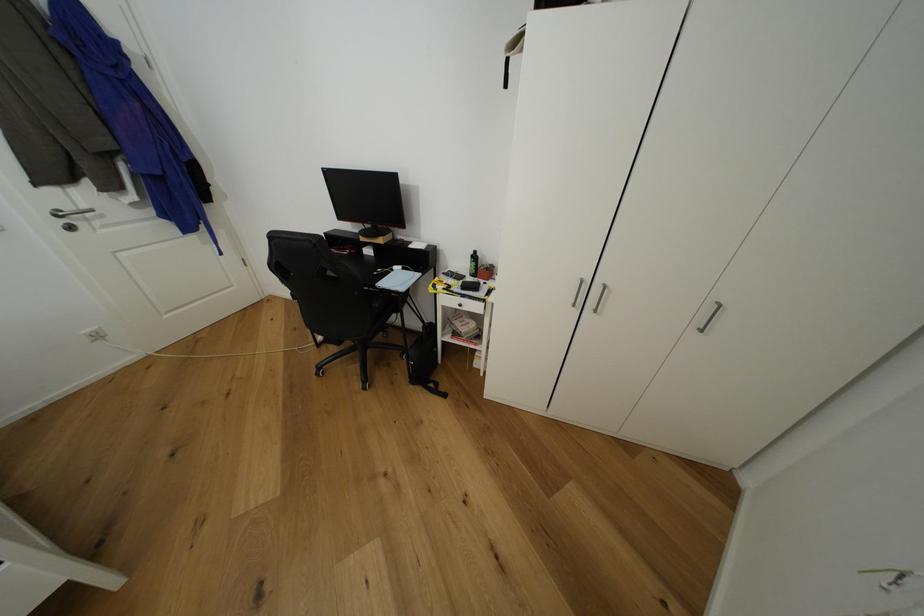
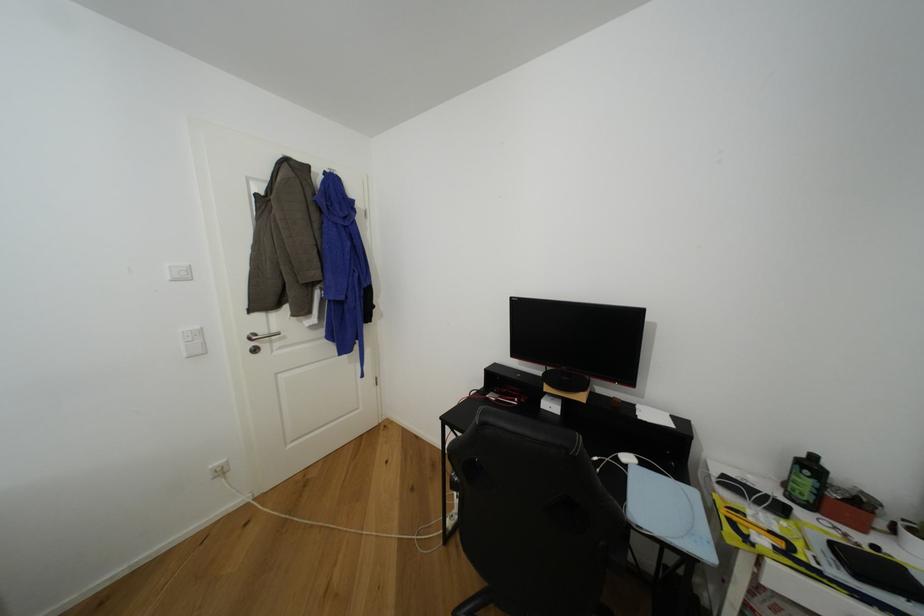
In the second image, find the point that corresponds to point (74, 209) in the first image.

(268, 334)